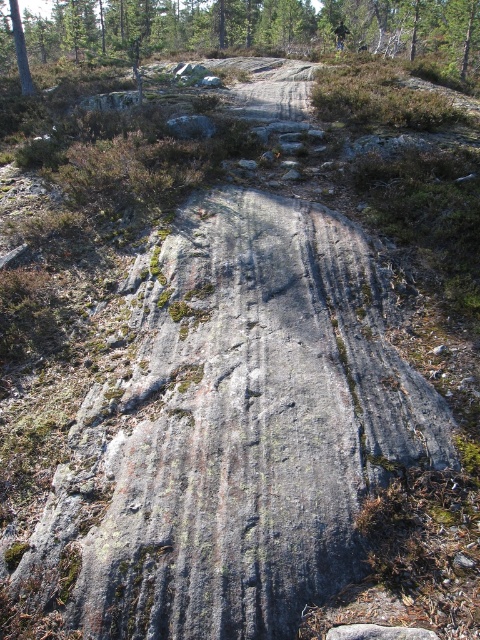
You are a hiker trying to navigate between the green mossy rock at upper center and the dark green fabric mountain biker at upper center. Which direction should you move to go from the mountain biker to the rock?

To move from the dark green fabric mountain biker at upper center to the green mossy rock at upper center, you should move to the left since the green mossy rock at upper center is positioned to the left of the mountain biker.

You are standing at the origin point of the coordinate system. Which direction should you move to reach the green mossy rock at upper center?

You should move towards the upper center direction to reach the green mossy rock at upper center.

You are planning to set up a tent for camping and need to choose between the smooth bark tree at upper left and the dark green fabric mountain biker at upper center as a reference point. Which object is positioned lower in the scene?

The smooth bark tree at upper left is positioned below the dark green fabric mountain biker at upper center, so the smooth bark tree at upper left is lower in the scene.